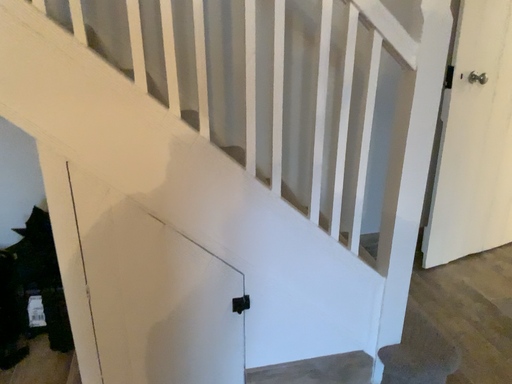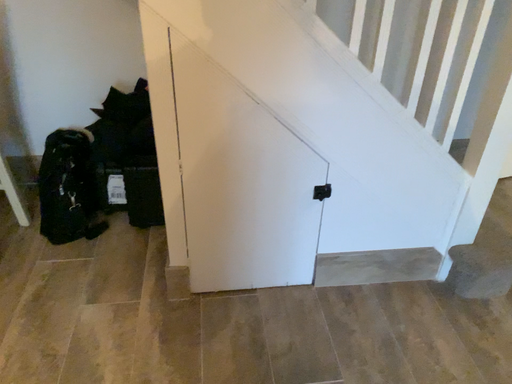
Question: How did the camera likely rotate when shooting the video?

Choices:
 (A) rotated downward
 (B) rotated upward

Answer: (A)